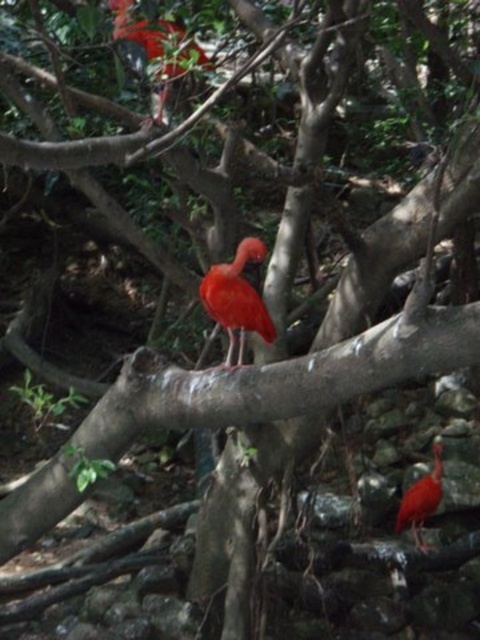
Who is positioned more to the left, smooth glossy red bird at center or smooth glossy red bird at lower right?

From the viewer's perspective, smooth glossy red bird at center appears more on the left side.

Between point (231, 317) and point (418, 547), which one is positioned behind?

The point (418, 547) is behind.

Image resolution: width=480 pixels, height=640 pixels. In order to click on smooth glossy red bird at center in this screenshot , I will do `click(237, 298)`.

You are a GUI agent. You are given a task and a screenshot of the screen. Output one action in this format:
    pyautogui.click(x=<x>, y=<y>)
    Task: Click on the smooth glossy red bird at center
    
    Given the screenshot: What is the action you would take?
    pyautogui.click(x=237, y=298)

Does smooth glossy red bird at upper center have a greater width compared to smooth glossy red bird at lower right?

Indeed, smooth glossy red bird at upper center has a greater width compared to smooth glossy red bird at lower right.

Which is above, smooth glossy red bird at upper center or smooth glossy red bird at lower right?

smooth glossy red bird at upper center

Which is in front, point (180, 28) or point (435, 460)?

Positioned in front is point (180, 28).

Where is `smooth glossy red bird at upper center`? smooth glossy red bird at upper center is located at coordinates (142, 29).

Based on the photo, can you confirm if smooth glossy red bird at center is positioned to the right of smooth glossy red bird at upper center?

Indeed, smooth glossy red bird at center is positioned on the right side of smooth glossy red bird at upper center.

From the picture: Does smooth glossy red bird at center have a greater width compared to smooth glossy red bird at upper center?

Incorrect, smooth glossy red bird at center's width does not surpass smooth glossy red bird at upper center's.

Does point (241, 285) come in front of point (163, 24)?

Yes, point (241, 285) is closer to viewer.

The image size is (480, 640). Find the location of `smooth glossy red bird at center`. smooth glossy red bird at center is located at coordinates (237, 298).